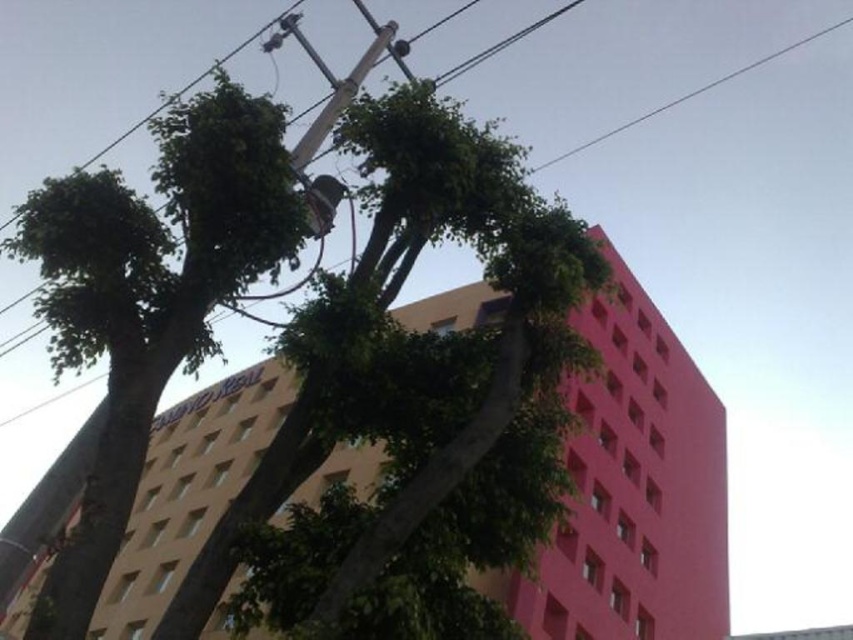
You are an architect designing a new pathway between the pink matte building at center and the green leafy tree at upper left. Based on their widths, which structure should you consider for the pathway design?

The pink matte building at center might be wider than green leafy tree at upper left, so the pathway should be designed to accommodate the width of the pink matte building at center to ensure proper spacing.

You are an urban planner assessing the cityscape. You notice the pink matte building at center and the metallic gray power line at upper center. Which structure is shorter in height?

The pink matte building at center is not as tall as the metallic gray power line at upper center, so the pink matte building at center is shorter in height.

You are a photographer aiming to capture the entire view of the beige modern building on the left and the taller structure on the right without any obstructions. You notice a point marked at coordinates point [698,90]. What potential obstruction might you need to be cautious of at that specific point?

The point [698,90] marks a metallic gray power line at upper center, so you need to be cautious of this power line obstructing your view of the buildings.